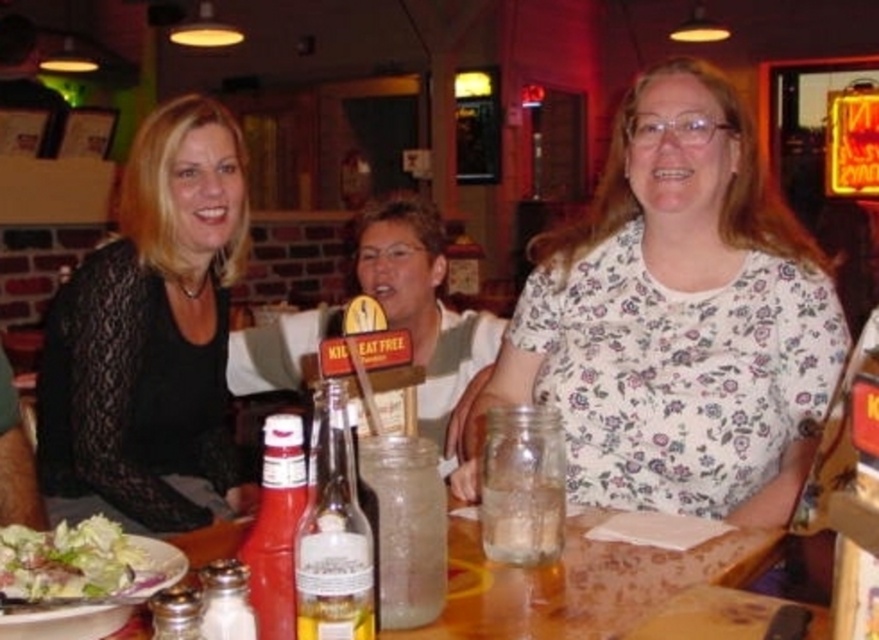
You are a waiter in a restaurant and need to place a new order on the table. The table has the black lace top at left and the green leafy salad at lower left. Which item should you avoid placing the new plate next to to ensure it doesn t get knocked over?

The black lace top at left is taller than the green leafy salad at lower left, so you should avoid placing the new plate next to the black lace top at left to prevent it from being knocked over.

You are standing in the dining area and want to take a photo of the black lace top at left with your camera. The camera requires a minimum distance of 3 feet to focus properly. Can you take a clear photo from your current position?

The black lace top at left and camera are 5.62 feet apart from each other. Since 5.62 feet is greater than the minimum required 3 feet, you can take a clear photo from your current position.